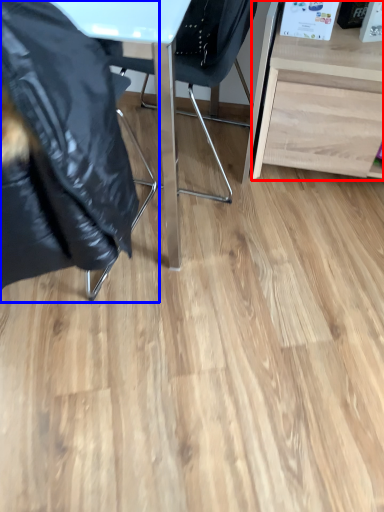
Question: Among these objects, which one is farthest to the camera, desk (highlighted by a red box) or chair (highlighted by a blue box)?

Choices:
 (A) desk
 (B) chair

Answer: (A)